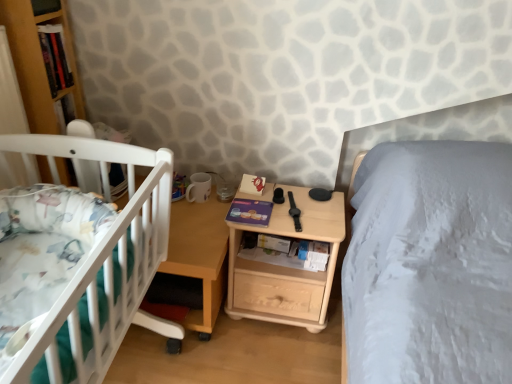
Find the location of a particular element. The image size is (512, 384). vacant point to the right of matte purple book at center, arranged as the second book when viewed from the top is located at coordinates (294, 204).